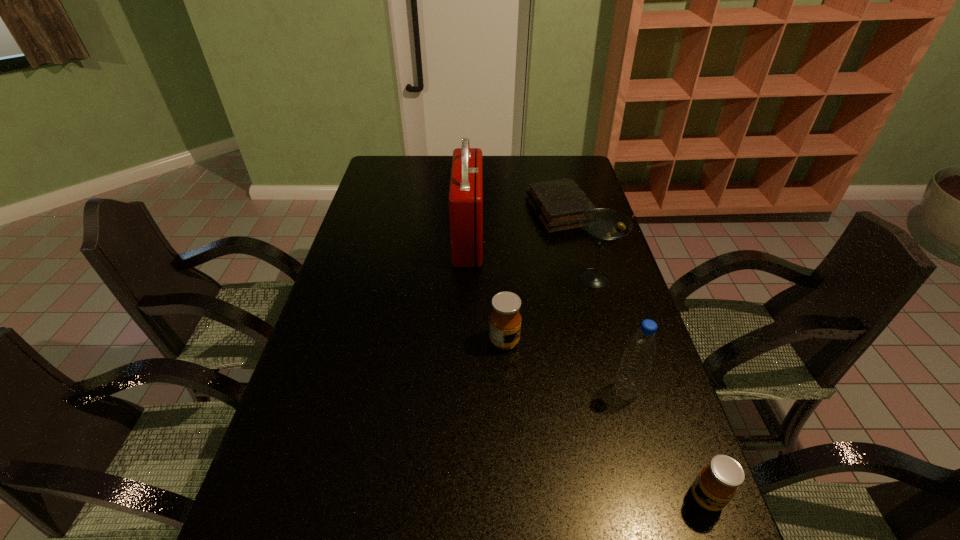
In order to click on free point that keeps the honeys evenly spaced on the left in this screenshot , I will do [x=384, y=248].